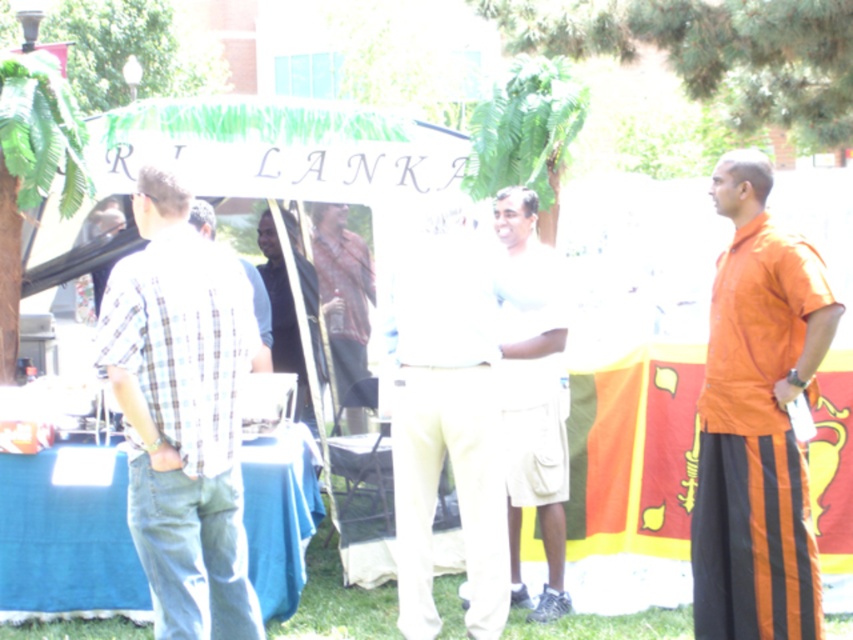
You are at the event and want to approach the person in the brown leather jacket at center. Which direction should you move relative to the plaid shirt at left?

To reach the brown leather jacket at center from the plaid shirt at left, you should move to the right since the plaid shirt at left is positioned to the left of the brown leather jacket at center.

Based on the provided scene description, what is the location of the point with coordinates (757, 420)?

The point with coordinates (757, 420) is located on the orange cotton kurta at right.

You are standing at the camera position and looking at the two points labeled point (477, 545) and point (293, 532). Which point is nearer to you?

Point (477, 545) is closer to the camera than point (293, 532).